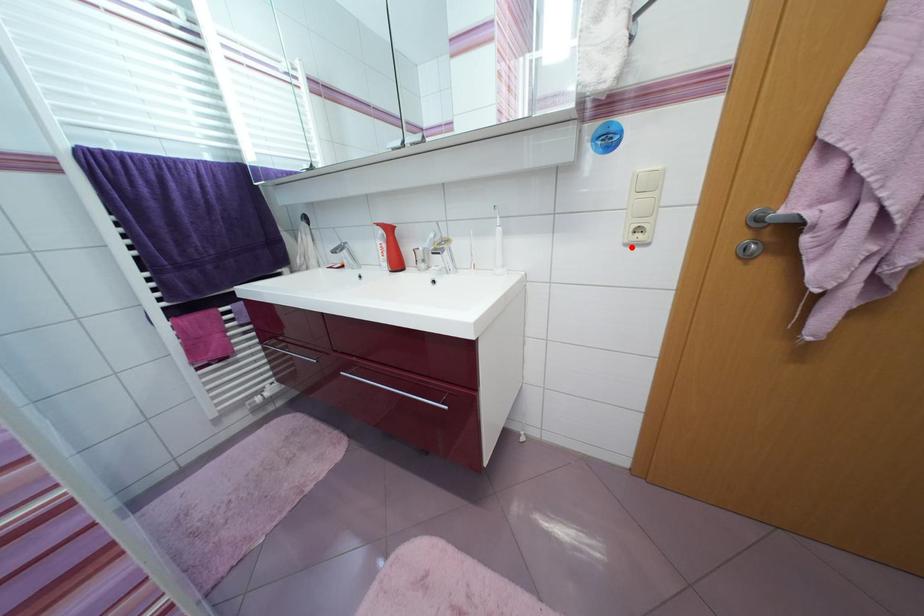
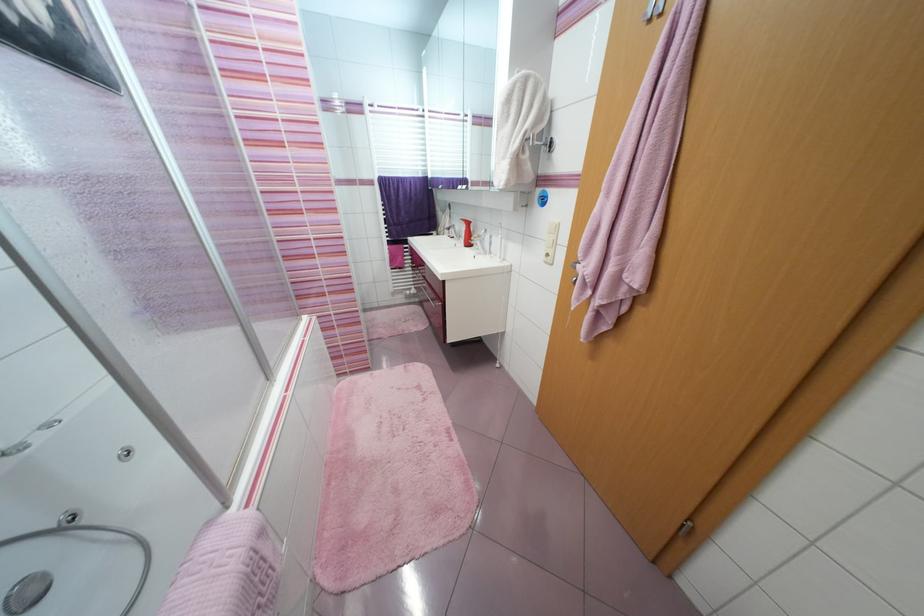
Question: I am providing you with two images of the same scene from different viewpoints. In image1, a red point is highlighted. Considering the same 3D point in image2, which of the following is correct?

Choices:
 (A) It is closer
 (B) It is farther

Answer: (A)